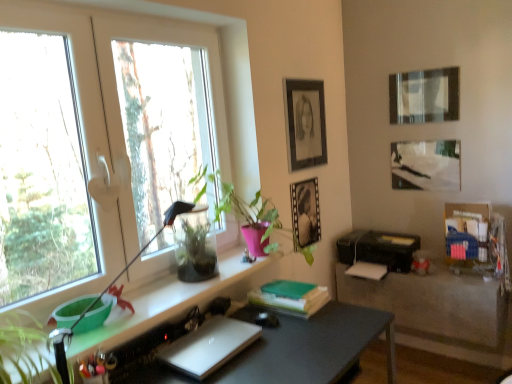
The height and width of the screenshot is (384, 512). Find the location of `translucent glass shelf at left`. translucent glass shelf at left is located at coordinates (163, 304).

Where is `matte black picture frame at upper right, which is the second picture frame in right-to-left order`? The width and height of the screenshot is (512, 384). matte black picture frame at upper right, which is the second picture frame in right-to-left order is located at coordinates (424, 96).

What is the approximate width of matte black picture frame at upper center, placed as the fourth picture frame when sorted from right to left?

matte black picture frame at upper center, placed as the fourth picture frame when sorted from right to left, is 1.77 centimeters in width.

Identify the location of matte black picture frame at upper center, which ranks as the first picture frame in left-to-right order. (305, 123).

Describe the element at coordinates (312, 348) in the screenshot. I see `matte gray desk at center` at that location.

I want to click on matte gray desk at center, so click(x=312, y=348).

Where is `metallic silver picture frame at center, the second picture frame from the left`? metallic silver picture frame at center, the second picture frame from the left is located at coordinates (305, 213).

Where is `translucent glass shelf at left`? This screenshot has width=512, height=384. translucent glass shelf at left is located at coordinates (163, 304).

Is matte black picture frame at upper center, which ranks as the first picture frame in left-to-right order, facing away from matte black picture frame at upper right, which is the second picture frame in right-to-left order?

No, matte black picture frame at upper center, which ranks as the first picture frame in left-to-right order, is not facing the opposite direction of matte black picture frame at upper right, which is the second picture frame in right-to-left order.

Where is `the 1st picture frame below the matte black picture frame at upper right, which is the second picture frame in right-to-left order (from the image's perspective)`? The image size is (512, 384). the 1st picture frame below the matte black picture frame at upper right, which is the second picture frame in right-to-left order (from the image's perspective) is located at coordinates (305, 123).

Choose the correct answer: Is matte black picture frame at upper center, placed as the fourth picture frame when sorted from right to left, inside matte black picture frame at upper right, arranged as the 3th picture frame when viewed from the left, or outside it?

matte black picture frame at upper center, placed as the fourth picture frame when sorted from right to left, is not enclosed by matte black picture frame at upper right, arranged as the 3th picture frame when viewed from the left.

From the picture: Does green matte book at center have a larger size compared to matte black picture frame at upper right, arranged as the 3th picture frame when viewed from the left?

Yes, green matte book at center is bigger than matte black picture frame at upper right, arranged as the 3th picture frame when viewed from the left.

Is green matte book at center looking in the opposite direction of matte black picture frame at upper right, arranged as the 3th picture frame when viewed from the left?

green matte book at center is not turned away from matte black picture frame at upper right, arranged as the 3th picture frame when viewed from the left.

Can you confirm if green matte book at center is positioned to the left of matte black picture frame at upper right, arranged as the 3th picture frame when viewed from the left?

Yes.

Is matte black picture frame at upper right, arranged as the 3th picture frame when viewed from the left, not inside sleek silver laptop at center?

matte black picture frame at upper right, arranged as the 3th picture frame when viewed from the left, lies outside sleek silver laptop at center's area.

Which is more to the left, matte black picture frame at upper right, which is the second picture frame in right-to-left order, or sleek silver laptop at center?

From the viewer's perspective, sleek silver laptop at center appears more on the left side.

From the image's perspective, between matte black picture frame at upper right, arranged as the 3th picture frame when viewed from the left, and sleek silver laptop at center, who is located below?

sleek silver laptop at center appears lower in the image.

Where is `picture frame that is the 3rd object to the right of the sleek silver laptop at center, starting at the anchor`? This screenshot has width=512, height=384. picture frame that is the 3rd object to the right of the sleek silver laptop at center, starting at the anchor is located at coordinates (424, 96).

From a real-world perspective, which is physically below, matte black picture frame at upper right, arranged as the 3th picture frame when viewed from the left, or black plastic printer at lower right?

black plastic printer at lower right, from a real-world perspective.

Is matte black picture frame at upper right, which is the second picture frame in right-to-left order, at the left side of black plastic printer at lower right?

No.

Is black plastic printer at lower right at the back of matte black picture frame at upper right, arranged as the 3th picture frame when viewed from the left?

matte black picture frame at upper right, arranged as the 3th picture frame when viewed from the left, is not turned away from black plastic printer at lower right.

Does matte black picture frame at upper right, arranged as the 3th picture frame when viewed from the left, have a greater height compared to black plastic printer at lower right?

Indeed, matte black picture frame at upper right, arranged as the 3th picture frame when viewed from the left, has a greater height compared to black plastic printer at lower right.

Considering the sizes of green matte book at center and metallic silver picture frame at center, the second picture frame from the left, in the image, is green matte book at center bigger or smaller than metallic silver picture frame at center, the second picture frame from the left,?

Considering their sizes, green matte book at center takes up more space than metallic silver picture frame at center, the second picture frame from the left.

Where is `book lying on the left of metallic silver picture frame at center, the second picture frame from the left`? Image resolution: width=512 pixels, height=384 pixels. book lying on the left of metallic silver picture frame at center, the second picture frame from the left is located at coordinates (290, 297).

Looking at this image, considering the sizes of objects green matte book at center and metallic silver picture frame at center, the 3th picture frame positioned from the right, in the image provided, who is taller, green matte book at center or metallic silver picture frame at center, the 3th picture frame positioned from the right,?

metallic silver picture frame at center, the 3th picture frame positioned from the right, is taller.

Does point (321, 286) lie behind point (309, 202)?

That is False.

Considering their positions, is metallic reflective picture frame at upper right, which appears as the 4th picture frame when viewed from the left, located in front of or behind transparent glass vase at window?

Clearly, metallic reflective picture frame at upper right, which appears as the 4th picture frame when viewed from the left, is behind transparent glass vase at window.

Between metallic reflective picture frame at upper right, which appears as the 4th picture frame when viewed from the left, and transparent glass vase at window, which one has larger size?

With larger size is transparent glass vase at window.

Does metallic reflective picture frame at upper right, which appears as the 4th picture frame when viewed from the left, have a larger size compared to green glossy plant at center?

Actually, metallic reflective picture frame at upper right, which appears as the 4th picture frame when viewed from the left, might be smaller than green glossy plant at center.

From the picture: Is metallic reflective picture frame at upper right, the 1th picture frame positioned from the right, beside green glossy plant at center?

No, metallic reflective picture frame at upper right, the 1th picture frame positioned from the right, is not with green glossy plant at center.

Which object is positioned more to the left, metallic reflective picture frame at upper right, which appears as the 4th picture frame when viewed from the left, or green glossy plant at center?

green glossy plant at center is more to the left.

There is a matte black picture frame at upper center, which ranks as the first picture frame in left-to-right order. Where is `picture frame above it (from a real-world perspective)`? This screenshot has width=512, height=384. picture frame above it (from a real-world perspective) is located at coordinates (424, 96).

The width and height of the screenshot is (512, 384). I want to click on picture frame that is the 4th object located above the green matte book at center (from the image's perspective), so click(x=424, y=96).

Looking at this image, estimate the real-world distances between objects in this image. Which object is closer to matte gray desk at center, translucent glass shelf at left or matte black picture frame at upper center, placed as the fourth picture frame when sorted from right to left?

Based on the image, translucent glass shelf at left appears to be nearer to matte gray desk at center.

Based on their spatial positions, is transparent glass vase at window or green glossy plant at center closer to matte black picture frame at upper center, which ranks as the first picture frame in left-to-right order?

Based on the image, green glossy plant at center appears to be nearer to matte black picture frame at upper center, which ranks as the first picture frame in left-to-right order.

From the image, which object appears to be nearer to transparent glass vase at window, matte black table at lower right or metallic silver picture frame at center, the second picture frame from the left?

The object closer to transparent glass vase at window is metallic silver picture frame at center, the second picture frame from the left.

When comparing their distances from transparent glass vase at window, does sleek silver laptop at center or translucent glass shelf at left seem further?

sleek silver laptop at center.

Which object lies nearer to the anchor point metallic reflective picture frame at upper right, which appears as the 4th picture frame when viewed from the left, matte black picture frame at upper center, which ranks as the first picture frame in left-to-right order, or black plastic printer at lower right?

The object closer to metallic reflective picture frame at upper right, which appears as the 4th picture frame when viewed from the left, is black plastic printer at lower right.

Considering their positions, is metallic silver picture frame at center, the 3th picture frame positioned from the right, positioned further to matte black picture frame at upper right, arranged as the 3th picture frame when viewed from the left, than green glossy plant at center?

The object further to matte black picture frame at upper right, arranged as the 3th picture frame when viewed from the left, is green glossy plant at center.

Looking at the image, which one is located closer to matte black picture frame at upper center, which ranks as the first picture frame in left-to-right order, translucent glass shelf at left or green matte book at center?

Based on the image, green matte book at center appears to be nearer to matte black picture frame at upper center, which ranks as the first picture frame in left-to-right order.

Based on their spatial positions, is transparent glass vase at window or green matte book at center closer to matte black picture frame at upper center, placed as the fourth picture frame when sorted from right to left?

green matte book at center is closer to matte black picture frame at upper center, placed as the fourth picture frame when sorted from right to left.

This screenshot has width=512, height=384. What are the coordinates of `book located between transparent glass window at upper left and matte black picture frame at upper center, which ranks as the first picture frame in left-to-right order, in the depth direction` in the screenshot? It's located at (290, 297).

Where is `shelf positioned between transparent glass window at upper left and matte black picture frame at upper center, which ranks as the first picture frame in left-to-right order, from near to far`? The image size is (512, 384). shelf positioned between transparent glass window at upper left and matte black picture frame at upper center, which ranks as the first picture frame in left-to-right order, from near to far is located at coordinates (163, 304).

Locate an element on the screen. This screenshot has width=512, height=384. table located between transparent glass window at upper left and matte black picture frame at upper right, which is the second picture frame in right-to-left order, in the left-right direction is located at coordinates (438, 312).

Where is `houseplant between transparent glass window at upper left and transparent glass vase at window from front to back`? The width and height of the screenshot is (512, 384). houseplant between transparent glass window at upper left and transparent glass vase at window from front to back is located at coordinates (239, 203).